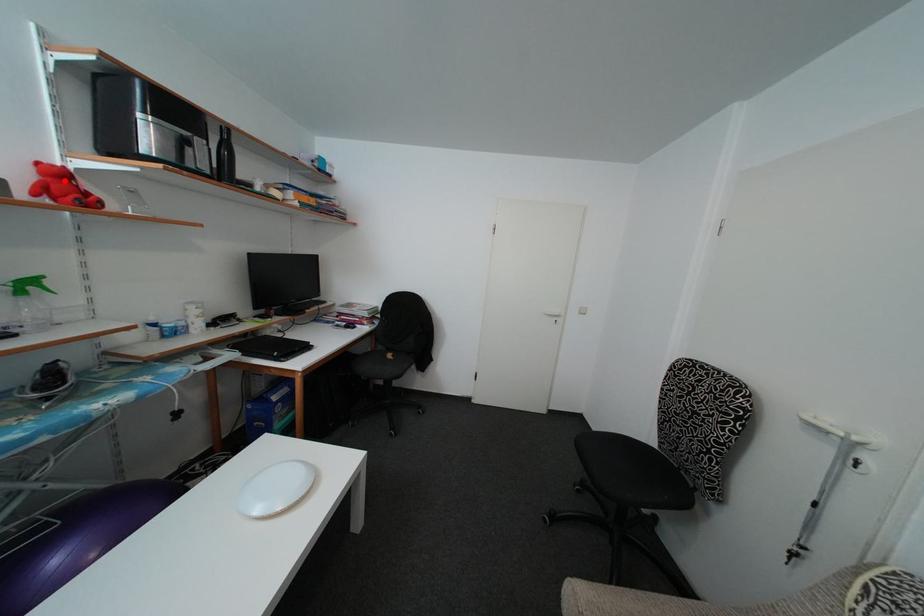
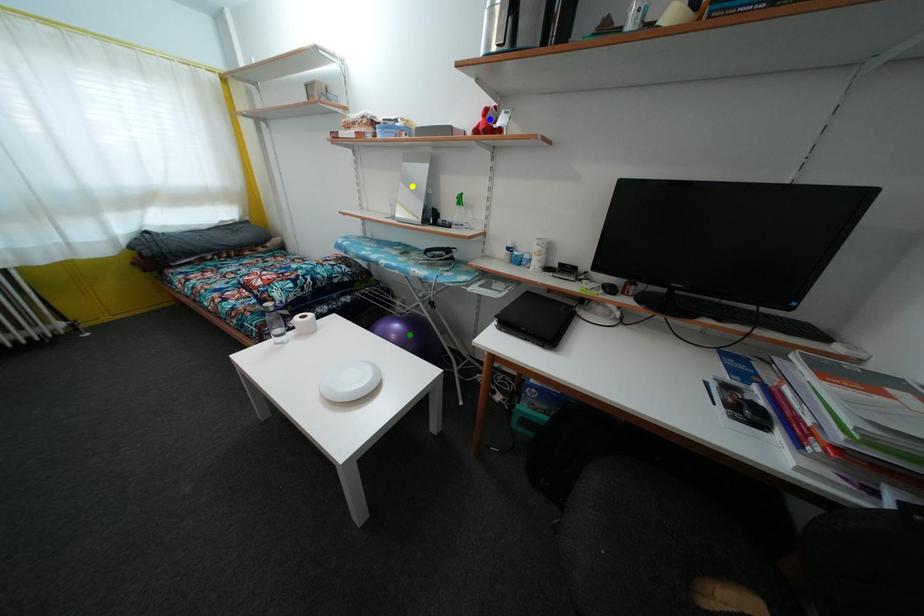
Question: I am providing you with two images of the same scene from different viewpoints. A red point is marked on the first image. You are given multiple points on the second image. Which point in image 2 is actually the same real-world point as the red point in image 1?

Choices:
 (A) yellow point
 (B) green point
 (C) blue point

Answer: (C)